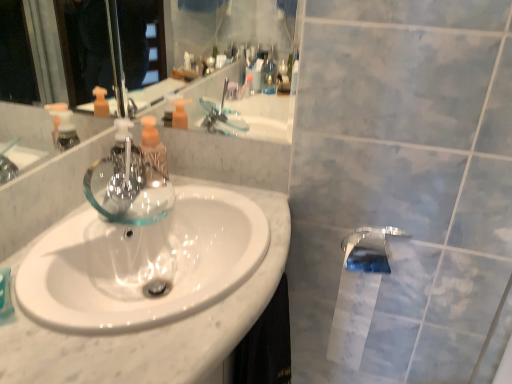
Question: Is white paper at lower right taller than polished chrome tap at lower right, the first tap viewed from the right?

Choices:
 (A) no
 (B) yes

Answer: (B)

Question: Are white paper at lower right and polished chrome tap at lower right, positioned as the second tap in top-to-bottom order, located far from each other?

Choices:
 (A) yes
 (B) no

Answer: (B)

Question: Is white paper at lower right positioned before polished chrome tap at lower right, acting as the second tap starting from the left?

Choices:
 (A) yes
 (B) no

Answer: (B)

Question: Considering the relative sizes of white paper at lower right and polished chrome tap at lower right, the first tap viewed from the right, in the image provided, is white paper at lower right shorter than polished chrome tap at lower right, the first tap viewed from the right,?

Choices:
 (A) yes
 (B) no

Answer: (B)

Question: From a real-world perspective, is white paper at lower right physically above polished chrome tap at lower right, acting as the second tap starting from the left?

Choices:
 (A) yes
 (B) no

Answer: (B)

Question: Considering the relative sizes of white paper at lower right and polished chrome tap at lower right, the first tap viewed from the right, in the image provided, is white paper at lower right thinner than polished chrome tap at lower right, the first tap viewed from the right,?

Choices:
 (A) yes
 (B) no

Answer: (B)

Question: Is white glossy sink at center surrounding transparent glass tap at center, acting as the 2th tap starting from the right?

Choices:
 (A) no
 (B) yes

Answer: (A)

Question: Does white glossy sink at center have a smaller size compared to transparent glass tap at center, positioned as the second tap in bottom-to-top order?

Choices:
 (A) yes
 (B) no

Answer: (B)

Question: Is white glossy sink at center at the right side of transparent glass tap at center, positioned as the second tap in bottom-to-top order?

Choices:
 (A) no
 (B) yes

Answer: (B)

Question: Is white glossy sink at center not close to transparent glass tap at center, the first tap from the top?

Choices:
 (A) no
 (B) yes

Answer: (A)

Question: From the image's perspective, is white glossy sink at center over transparent glass tap at center, positioned as the second tap in bottom-to-top order?

Choices:
 (A) no
 (B) yes

Answer: (A)

Question: Is white glossy sink at center positioned beyond the bounds of transparent glass tap at center, which is the first tap in left-to-right order?

Choices:
 (A) no
 (B) yes

Answer: (B)

Question: Is translucent plastic soap dispenser at center in front of white paper at lower right?

Choices:
 (A) no
 (B) yes

Answer: (B)